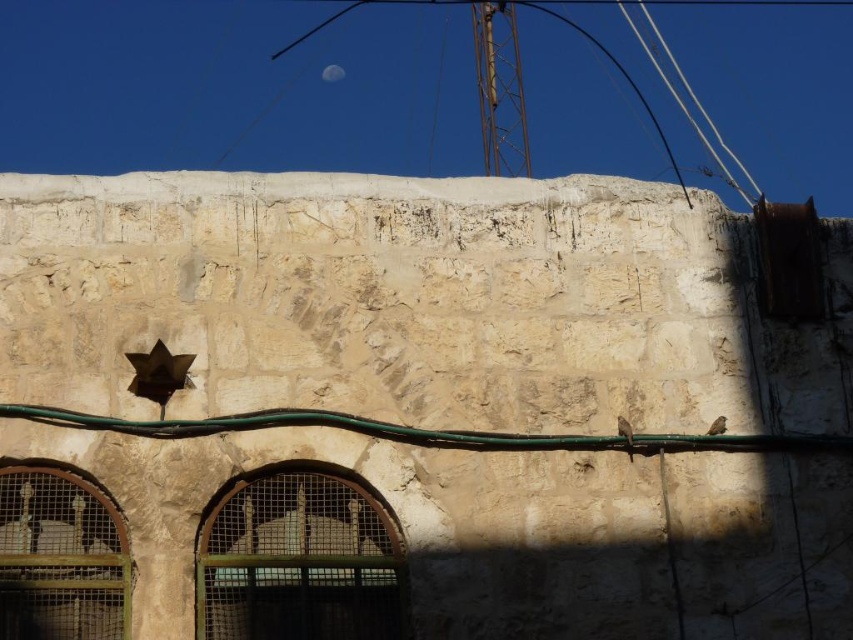
Which of these two, green rubber wire at center or silvery reflective moon at upper center, stands shorter?

Standing shorter between the two is silvery reflective moon at upper center.

Does point (757, 436) come in front of point (332, 74)?

Yes, it is.

Identify the location of green rubber wire at center. (x=428, y=432).

Based on the photo, who is taller, green rubber wire at center or white rope at upper center?

Standing taller between the two is white rope at upper center.

Which is below, green rubber wire at center or white rope at upper center?

Positioned lower is green rubber wire at center.

The width and height of the screenshot is (853, 640). What are the coordinates of `green rubber wire at center` in the screenshot? It's located at (428, 432).

In the scene shown: Can you confirm if white rope at upper center is thinner than silvery reflective moon at upper center?

No, white rope at upper center is not thinner than silvery reflective moon at upper center.

Does white rope at upper center have a smaller size compared to silvery reflective moon at upper center?

No, white rope at upper center is not smaller than silvery reflective moon at upper center.

Who is more forward, (x=730, y=156) or (x=341, y=77)?

Positioned in front is point (x=341, y=77).

The height and width of the screenshot is (640, 853). I want to click on white rope at upper center, so click(685, 96).